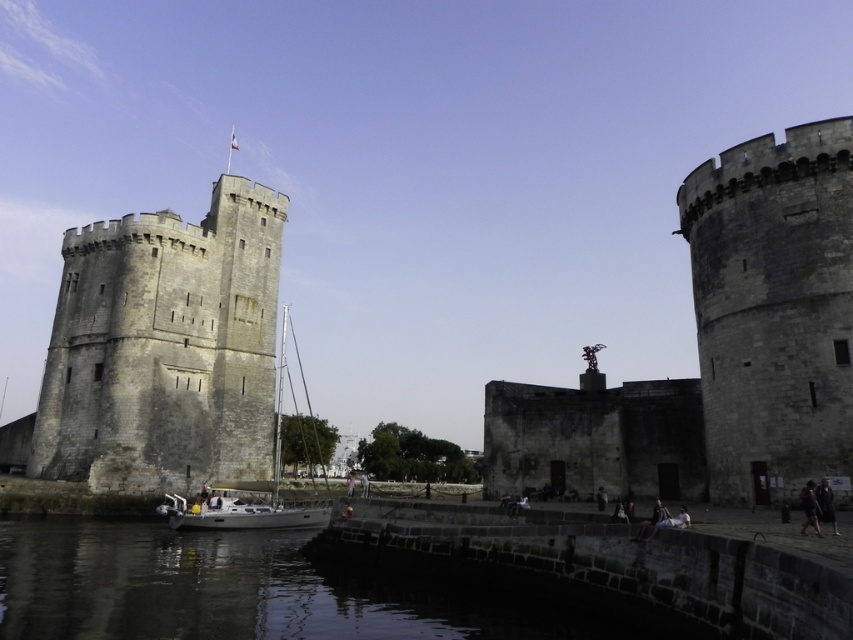
Is gray stone tower at left to the left of black stone water at lower center from the viewer's perspective?

Yes, gray stone tower at left is to the left of black stone water at lower center.

Does gray stone tower at left appear on the right side of black stone water at lower center?

No, gray stone tower at left is not to the right of black stone water at lower center.

Between point (114, 396) and point (463, 595), which one is positioned behind?

Positioned behind is point (114, 396).

What are the coordinates of `gray stone tower at left` in the screenshot? It's located at (164, 348).

Does gray stone fort at center appear on the right side of white matte sailboat at center?

Yes, gray stone fort at center is to the right of white matte sailboat at center.

Is point (746, 486) closer to viewer compared to point (202, 522)?

That is True.

Where is `gray stone fort at center`? gray stone fort at center is located at coordinates (720, 348).

Does dark brown leather jacket at lower right appear under dark gray fabric jacket at lower right?

Yes, dark brown leather jacket at lower right is below dark gray fabric jacket at lower right.

Is point (808, 509) positioned behind point (828, 504)?

Yes, point (808, 509) is farther from viewer.

Which is behind, point (808, 508) or point (833, 525)?

The point (808, 508) is behind.

Where is `dark brown leather jacket at lower right`? This screenshot has height=640, width=853. dark brown leather jacket at lower right is located at coordinates (809, 508).